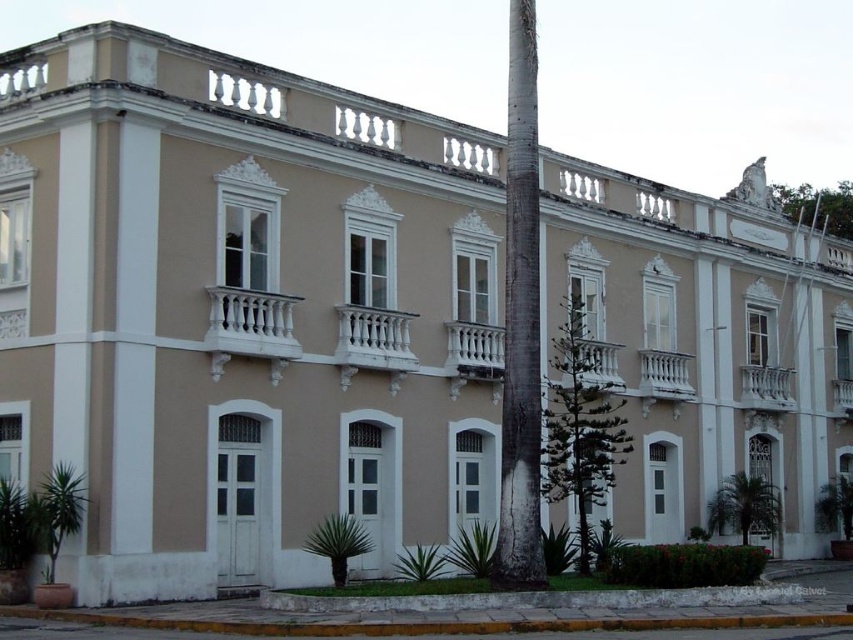
Based on the photo, you are standing in front of the building and notice two trees. One is the green leafy palm tree at lower left and the other is the green leafy tree at upper right. Which tree is positioned more to the left side of the scene?

The green leafy palm tree at lower left is positioned more to the left side of the scene compared to the green leafy tree at upper right.

You are standing in front of the building and want to take a photo of the green leafy palm tree at lower center without any obstruction. Is the green leafy tree at upper right blocking your view of it?

The green leafy palm tree at lower center is behind the green leafy tree at upper right, so the green leafy tree at upper right is blocking the view of the green leafy palm tree at lower center.

You are standing in front of the building and want to know which tree is taller between the green leafy tree at upper right and the green leafy palm tree at lower center. Can you determine this based on their positions?

The green leafy tree at upper right is much taller than the green leafy palm tree at lower center according to their positions in the image.